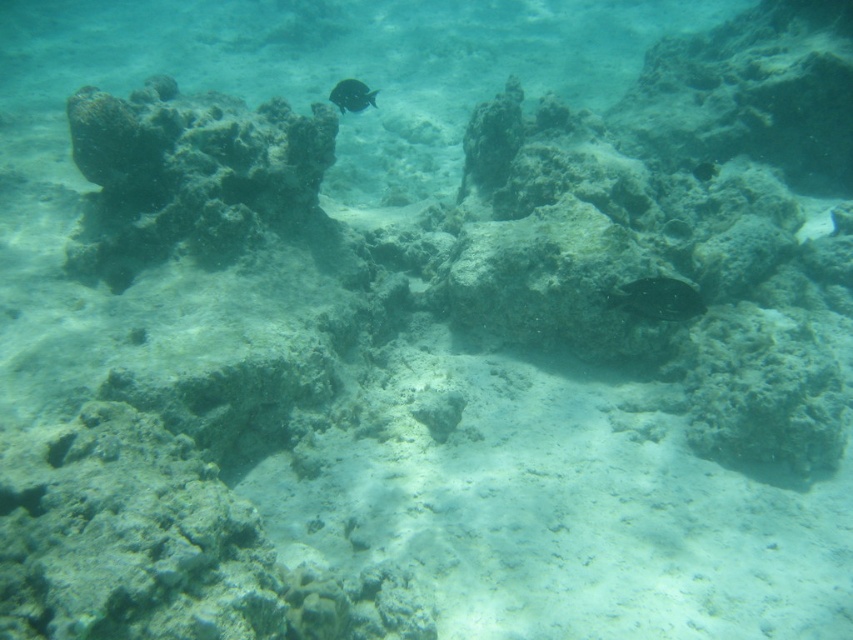
Who is higher up, dark brown coral at upper left or shiny green fish at center?

dark brown coral at upper left is higher up.

Measure the distance between point (252, 152) and camera.

Point (252, 152) is 8.65 feet away from camera.

Locate an element on the screen. The height and width of the screenshot is (640, 853). dark brown coral at upper left is located at coordinates (189, 176).

Is point (650, 296) closer to viewer compared to point (364, 108)?

That is True.

Measure the distance between point (625, 291) and camera.

8.31 feet

At what (x,y) coordinates should I click in order to perform the action: click on shiny green fish at center. Please return your answer as a coordinate pair (x, y). The image size is (853, 640). Looking at the image, I should click on (657, 298).

Image resolution: width=853 pixels, height=640 pixels. Find the location of `shiny green fish at center`. shiny green fish at center is located at coordinates (657, 298).

Between dark brown coral at upper left and shiny black fish at center, which one has less height?

With less height is shiny black fish at center.

Is point (169, 168) closer to camera compared to point (329, 92)?

That is True.

This screenshot has height=640, width=853. What are the coordinates of `dark brown coral at upper left` in the screenshot? It's located at (189, 176).